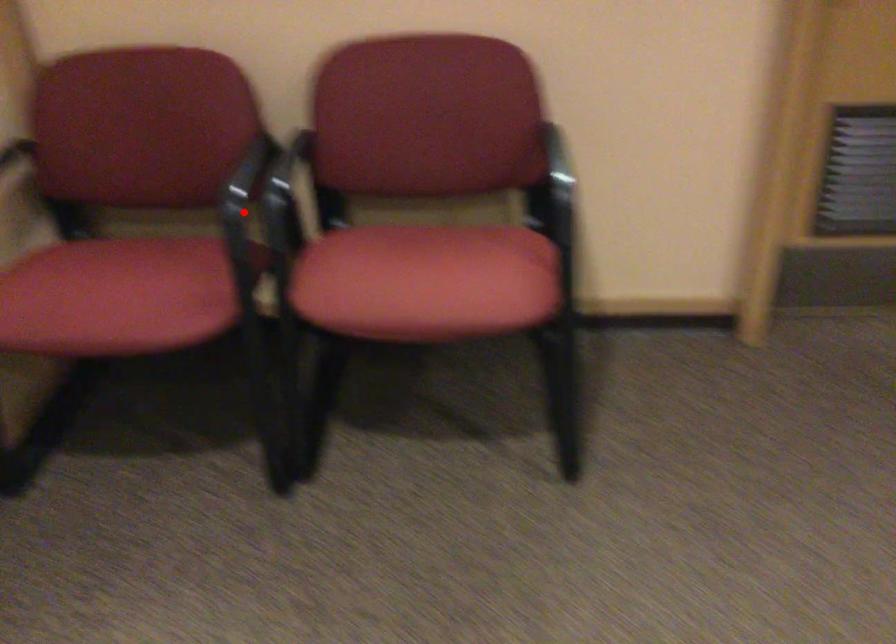
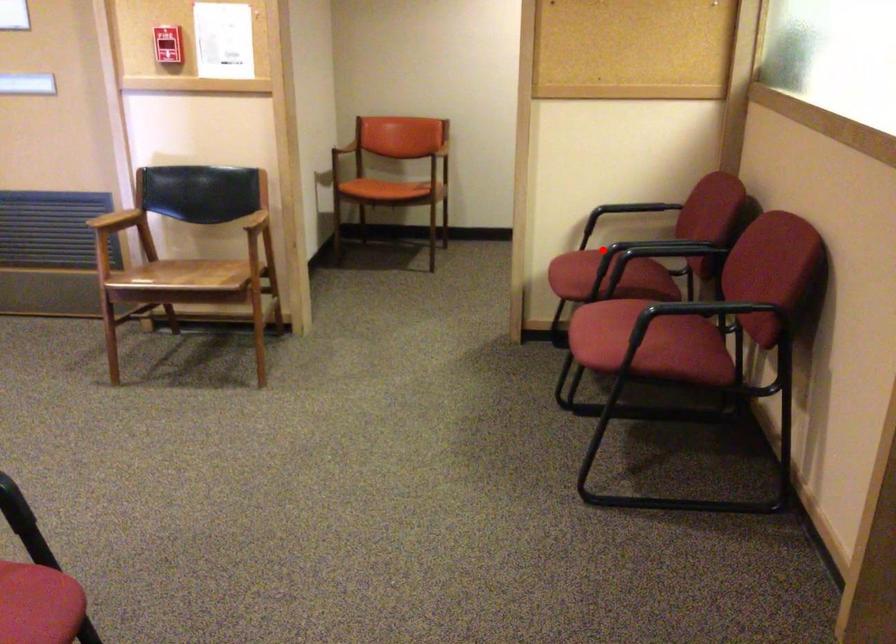
I am providing you with two images of the same scene from different viewpoints. A red point is marked on the first image and another point is marked on the second image. Does the point marked in image1 correspond to the same location as the one in image2?

Yes